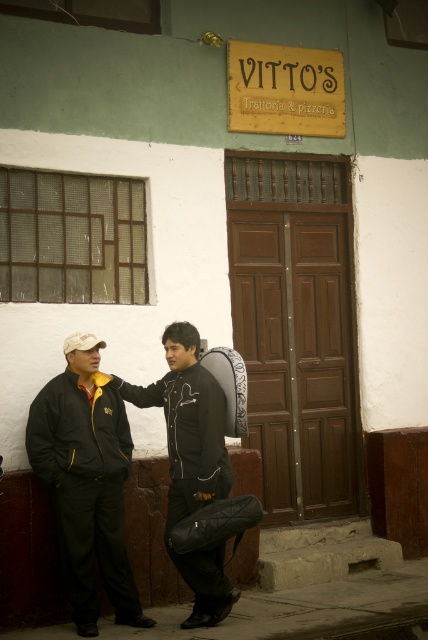
Who is higher up, black leather jacket at center or black leather backpack at center?

Positioned higher is black leather backpack at center.

Who is shorter, black leather jacket at center or black leather backpack at center?

black leather backpack at center is shorter.

Is point (180, 474) positioned after point (229, 417)?

No, (180, 474) is closer to viewer.

Locate an element on the screen. black leather jacket at center is located at coordinates (192, 461).

Does matte black jacket at left appear on the left side of black leather jacket at center?

Correct, you'll find matte black jacket at left to the left of black leather jacket at center.

Is matte black jacket at left taller than black leather jacket at center?

No, matte black jacket at left is not taller than black leather jacket at center.

The image size is (428, 640). Identify the location of matte black jacket at left. (86, 481).

Does matte black jacket at left come in front of black leather backpack at center?

That is True.

Between matte black jacket at left and black leather backpack at center, which one is positioned higher?

black leather backpack at center is above.

Is point (89, 604) positioned before point (243, 385)?

Yes, it is.

Identify the location of matte black jacket at left. (86, 481).